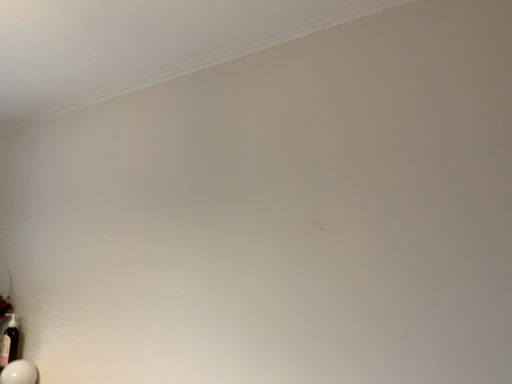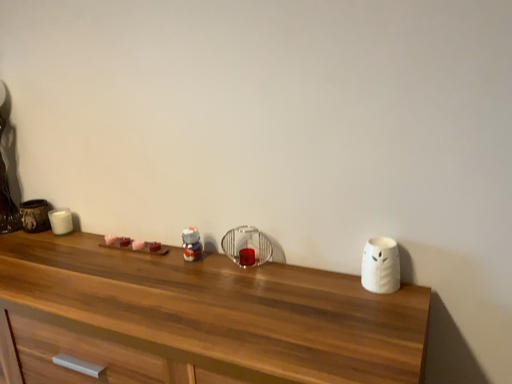
Question: Which way did the camera rotate in the video?

Choices:
 (A) rotated upward
 (B) rotated downward

Answer: (B)